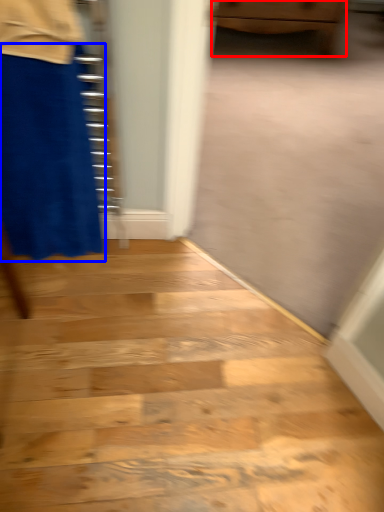
Question: Which of the following is the closest to the observer, furniture (highlighted by a red box) or miniskirt (highlighted by a blue box)?

Choices:
 (A) furniture
 (B) miniskirt

Answer: (B)